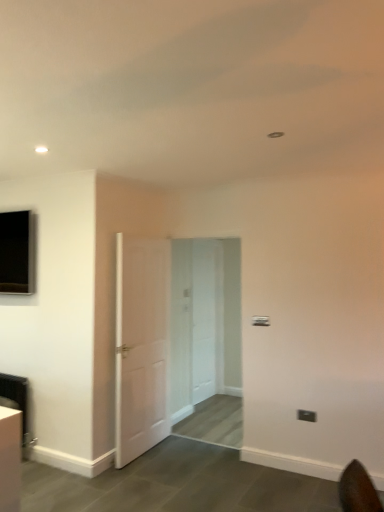
Where is `empty space that is ontop of black glass window at upper left (from a real-world perspective)`? empty space that is ontop of black glass window at upper left (from a real-world perspective) is located at coordinates (20, 204).